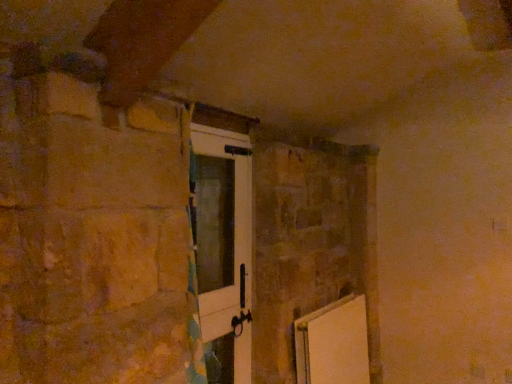
Image resolution: width=512 pixels, height=384 pixels. I want to click on white matte barn door at center, so click(x=224, y=251).

The height and width of the screenshot is (384, 512). Describe the element at coordinates (224, 251) in the screenshot. I see `white matte barn door at center` at that location.

This screenshot has width=512, height=384. What are the coordinates of `white matte barn door at center` in the screenshot? It's located at (224, 251).